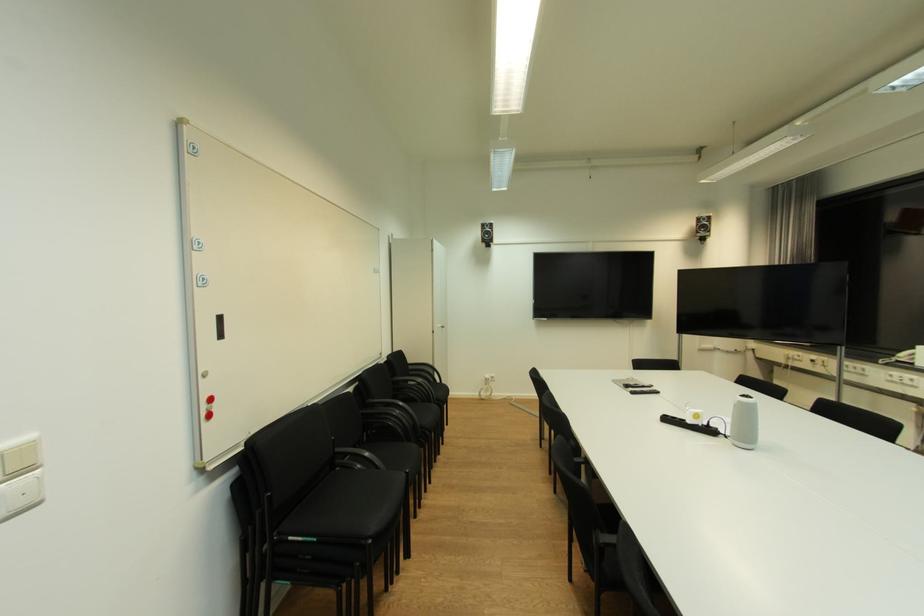
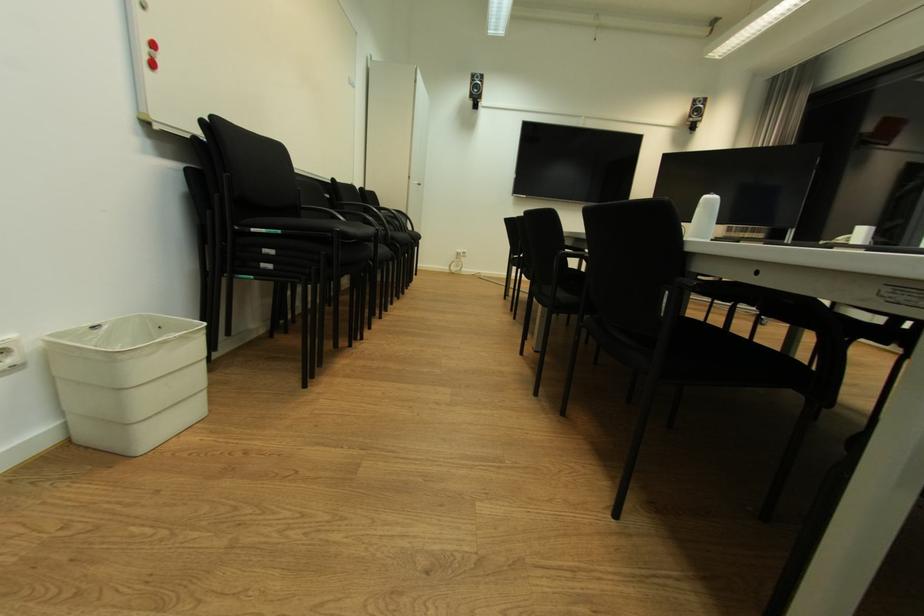
Which direction would the cameraman need to move to produce the second image?

The cameraman moved toward right, backward.